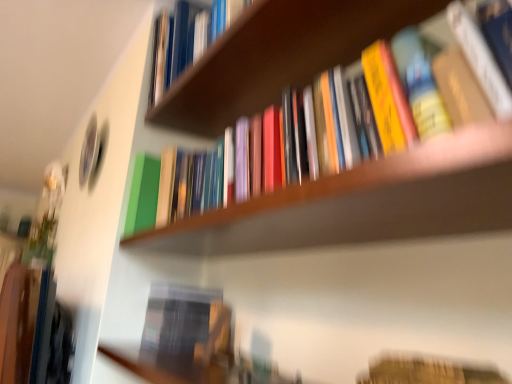
Question: From their relative heights in the image, would you say wooden bookshelf at upper center is taller or shorter than wooden bookshelf at center?

Choices:
 (A) short
 (B) tall

Answer: (A)

Question: From a real-world perspective, is wooden bookshelf at upper center physically located above or below wooden bookshelf at center?

Choices:
 (A) below
 (B) above

Answer: (B)

Question: Which is nearer to the wooden bookshelf at center?

Choices:
 (A) hardcover book at lower right, the 3th book in the top-to-bottom sequence
 (B) hardcover books at upper center, the 2th book positioned from the top
 (C) wooden bookshelf at upper center
 (D) hardcover book at upper center, the third book in the bottom-to-top sequence

Answer: (A)

Question: Considering the real-world distances, which object is closest to the hardcover book at upper center, arranged as the first book when viewed from the top?

Choices:
 (A) hardcover book at lower right, acting as the 1th book starting from the bottom
 (B) hardcover books at upper center, which is counted as the 2th book, starting from the bottom
 (C) wooden bookshelf at upper center
 (D) wooden bookshelf at center

Answer: (B)